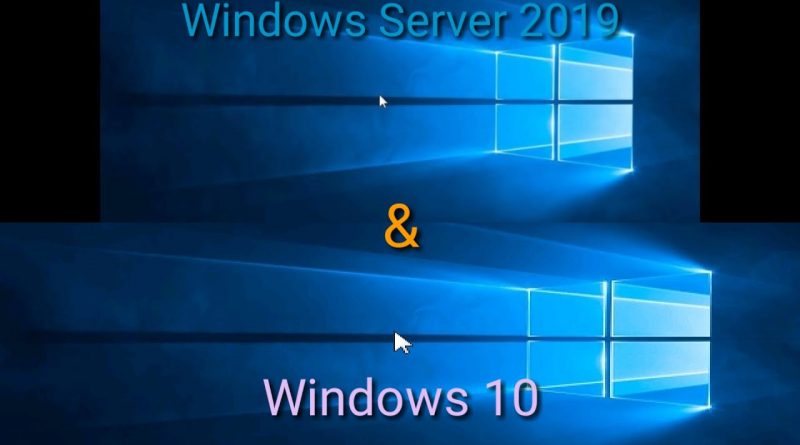
You are a GUI agent. You are given a task and a screenshot of the screen. Output one action in this format:
    pyautogui.click(x=<x>, y=<y>)
    Task: Click on the floor
    
    Given the screenshot: What is the action you would take?
    pyautogui.click(x=358, y=191), pyautogui.click(x=493, y=435)